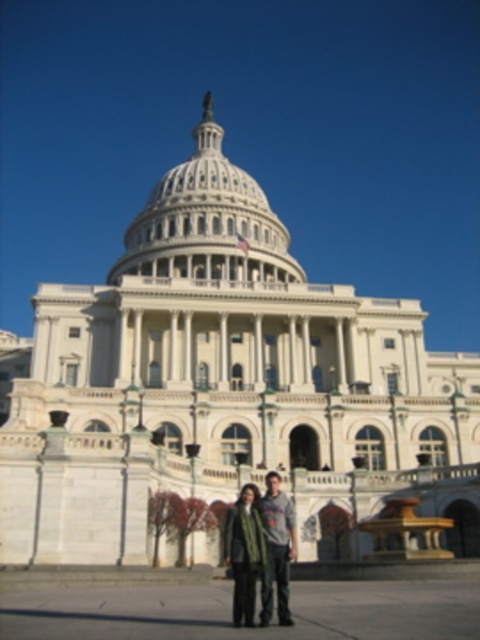
You are a tourist standing in front of the United States Capitol Building and want to take a photo. You notice two points marked on your map at coordinates point (176, 244) and point (250, 595). Which point is closer to you?

Point (176, 244) is closer to you because it is further to the viewer than point (250, 595).

You are a tourist standing at the base of the white marble dome at center. You want to take a photo that includes the entire dome in the frame. Your camera has a standard lens with a 50mm focal length. Given that the recommended distance for capturing the entire dome with this lens is 100 meters, can you move to a position that allows you to take the photo?

The white marble dome at center and viewer are 99.85 meters apart from each other. Since the recommended distance is 100 meters, you are very close to the required distance. Moving back slightly to reach exactly 100 meters would ensure the entire dome fits in the frame.